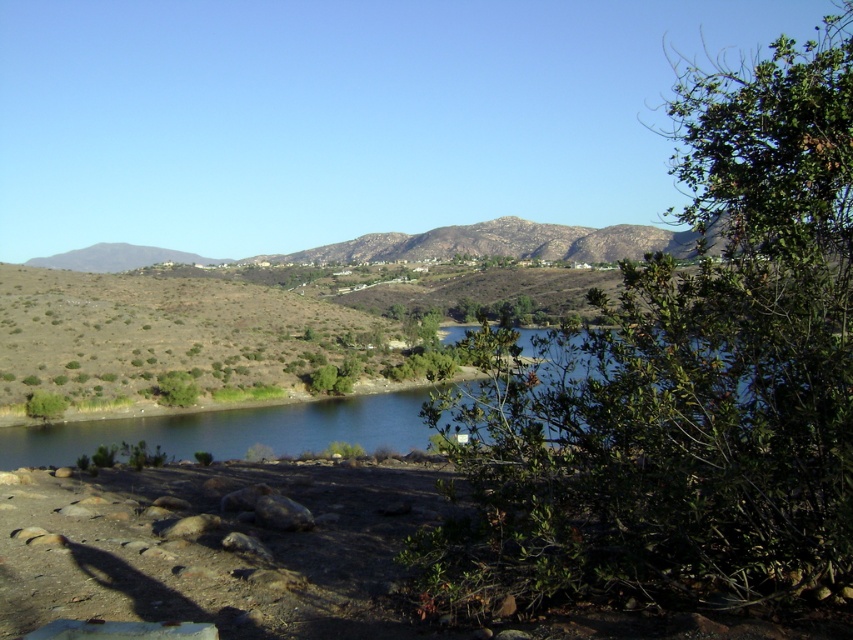
Is green leafy bush at right shorter than green leafy bush at lower left?

No, green leafy bush at right is not shorter than green leafy bush at lower left.

Does green leafy bush at right have a smaller size compared to green leafy bush at lower left?

Actually, green leafy bush at right might be larger than green leafy bush at lower left.

Is point (762, 324) in front of point (44, 403)?

Yes, point (762, 324) is closer to viewer.

Where is `green leafy bush at right`? green leafy bush at right is located at coordinates (683, 381).

Between green leafy bush at right and green leafy tree at lower left, which one is positioned lower?

green leafy tree at lower left is below.

Can you confirm if green leafy bush at right is positioned to the right of green leafy tree at lower left?

Yes, green leafy bush at right is to the right of green leafy tree at lower left.

Does point (767, 532) come in front of point (177, 387)?

That is True.

At what (x,y) coordinates should I click in order to perform the action: click on green leafy bush at right. Please return your answer as a coordinate pair (x, y). Image resolution: width=853 pixels, height=640 pixels. Looking at the image, I should click on (683, 381).

Can you confirm if green leafy tree at lower left is smaller than green leafy bush at lower left?

Correct, green leafy tree at lower left occupies less space than green leafy bush at lower left.

Between green leafy tree at lower left and green leafy bush at lower left, which one appears on the right side from the viewer's perspective?

green leafy tree at lower left

Is point (193, 401) in front of point (56, 417)?

No, (193, 401) is behind (56, 417).

Where is `green leafy tree at lower left`? The image size is (853, 640). green leafy tree at lower left is located at coordinates (177, 388).